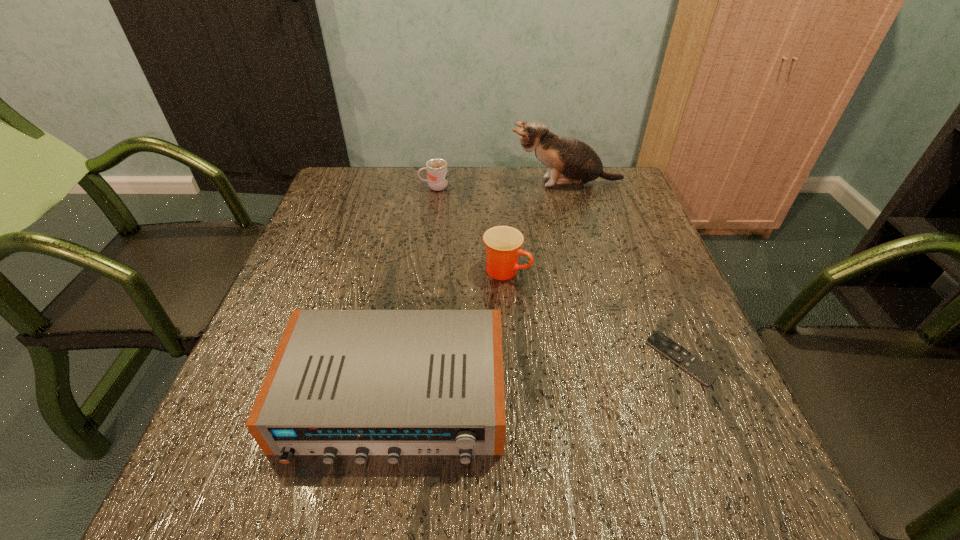
At what (x,y) coordinates should I click in order to perform the action: click on vacant position located 0.100m on the side with the handle of the farther cup. Please return your answer as a coordinate pair (x, y). The image size is (960, 540). Looking at the image, I should click on (385, 187).

You are a GUI agent. You are given a task and a screenshot of the screen. Output one action in this format:
    pyautogui.click(x=<x>, y=<y>)
    Task: Click on the vacant space located on the side with the handle of the farther cup
    
    Given the screenshot: What is the action you would take?
    pyautogui.click(x=389, y=187)

This screenshot has width=960, height=540. I want to click on free space located on the front of the third farthest object, so click(512, 355).

At what (x,y) coordinates should I click in order to perform the action: click on free location located on the left of the shortest object. Please return your answer as a coordinate pair (x, y). Image resolution: width=960 pixels, height=540 pixels. Looking at the image, I should click on (502, 358).

Locate an element on the screen. The height and width of the screenshot is (540, 960). cat present at the far edge is located at coordinates click(570, 162).

This screenshot has width=960, height=540. Identify the location of cup that is at the far edge. coord(437,175).

Locate an element on the screen. The image size is (960, 540). object at the near edge is located at coordinates (342, 382).

Find the location of a particular element. object at the left edge is located at coordinates (342, 382).

This screenshot has width=960, height=540. In order to click on cat located in the right edge section of the desktop in this screenshot , I will do (x=570, y=162).

Where is `remote control that is at the right edge`? The width and height of the screenshot is (960, 540). remote control that is at the right edge is located at coordinates (697, 368).